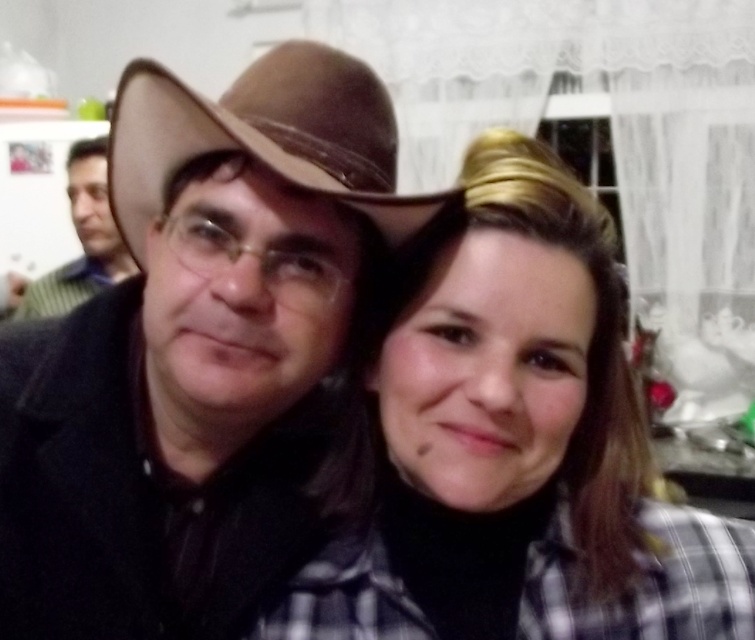
You are designing a layout for a magazine cover and need to place two photos side by side. The first photo contains the plaid fabric shirt at center, and the second has the matte black shirt at left. If you want to maintain the same visual scale for both shirts, which shirt should you adjust to be wider?

The plaid fabric shirt at center has a smaller width than the matte black shirt at left. To maintain the same visual scale, you should adjust the plaid fabric shirt at center to be wider.

You are a photographer adjusting the camera settings for a group photo. The scene includes a brown leather cowboy hat at upper left and a matte black shirt at left. Which object is narrower in width?

The brown leather cowboy hat at upper left is narrower in width than the matte black shirt at left.

You are a photographer trying to adjust the lighting for a group photo. You notice the brown leather cowboy hat at upper left and the matte black shirt at left. Which object is farther away from the camera?

The brown leather cowboy hat at upper left is farther away from the camera than the matte black shirt at left because it is 2.22 meters away from the matte black shirt at left.